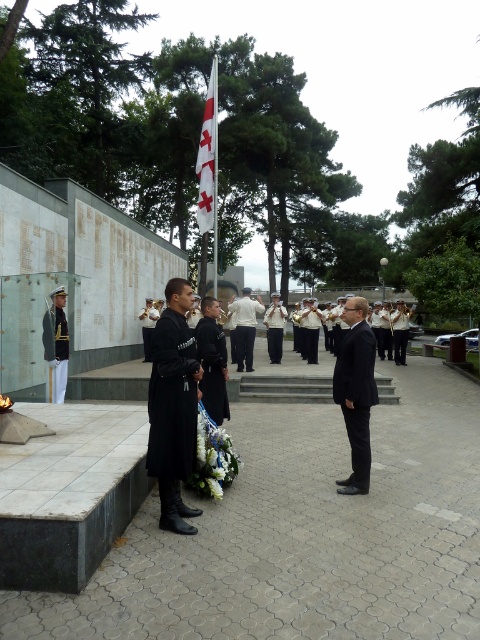
Does white fabric flag at center have a larger size compared to white shirt at center?

Yes, white fabric flag at center is bigger than white shirt at center.

Is white fabric flag at center to the right of white shirt at center from the viewer's perspective?

Incorrect, white fabric flag at center is not on the right side of white shirt at center.

Who is more distant from viewer, (206, 188) or (252, 324)?

The point (252, 324) is more distant.

Where is `white fabric flag at center`? white fabric flag at center is located at coordinates point(208,157).

Which is below, black matte coat at left or dark suit at center?

black matte coat at left is below.

Between black matte coat at left and dark suit at center, which one has less height?

Standing shorter between the two is dark suit at center.

Is point (176, 380) more distant than point (357, 348)?

No, it is not.

You are a GUI agent. You are given a task and a screenshot of the screen. Output one action in this format:
    pyautogui.click(x=<x>, y=<y>)
    Task: Click on the black matte coat at left
    The height and width of the screenshot is (640, 480).
    Given the screenshot: What is the action you would take?
    pyautogui.click(x=171, y=397)

Which is more to the left, black matte uniform at center or gold metallic uniform at left?

gold metallic uniform at left is more to the left.

Which is in front, point (203, 360) or point (60, 348)?

Point (203, 360) is in front.

Find the location of a particular element. The width and height of the screenshot is (480, 640). black matte uniform at center is located at coordinates (213, 368).

This screenshot has height=640, width=480. In order to click on black matte uniform at center in this screenshot , I will do `click(213, 368)`.